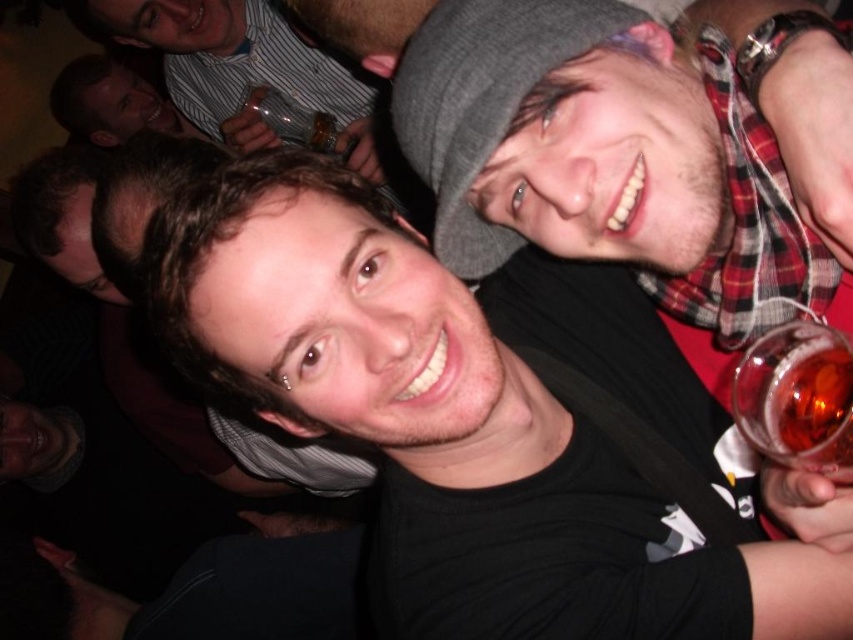
Can you confirm if black matte shirt at center is taller than dark brown leather jacket at upper left?

Indeed, black matte shirt at center has a greater height compared to dark brown leather jacket at upper left.

Who is more forward, (654,500) or (123,131)?

Point (654,500) is in front.

Which is behind, point (311, 352) or point (68, 90)?

Positioned behind is point (68, 90).

At what (x,y) coordinates should I click in order to perform the action: click on black matte shirt at center. Please return your answer as a coordinate pair (x, y). The height and width of the screenshot is (640, 853). Looking at the image, I should click on (465, 413).

Which is behind, point (799, 556) or point (341, 97)?

Positioned behind is point (341, 97).

What do you see at coordinates (465, 413) in the screenshot? The height and width of the screenshot is (640, 853). I see `black matte shirt at center` at bounding box center [465, 413].

Locate an element on the screen. The image size is (853, 640). black matte shirt at center is located at coordinates (465, 413).

Where is `black matte shirt at center`? This screenshot has height=640, width=853. black matte shirt at center is located at coordinates (465, 413).

Does striped shirt at upper left have a smaller size compared to translucent glass wine at right?

No.

Between striped shirt at upper left and translucent glass wine at right, which one has more height?

striped shirt at upper left is taller.

Does point (141, 33) come in front of point (757, 429)?

No.

Locate an element on the screen. striped shirt at upper left is located at coordinates (241, 67).